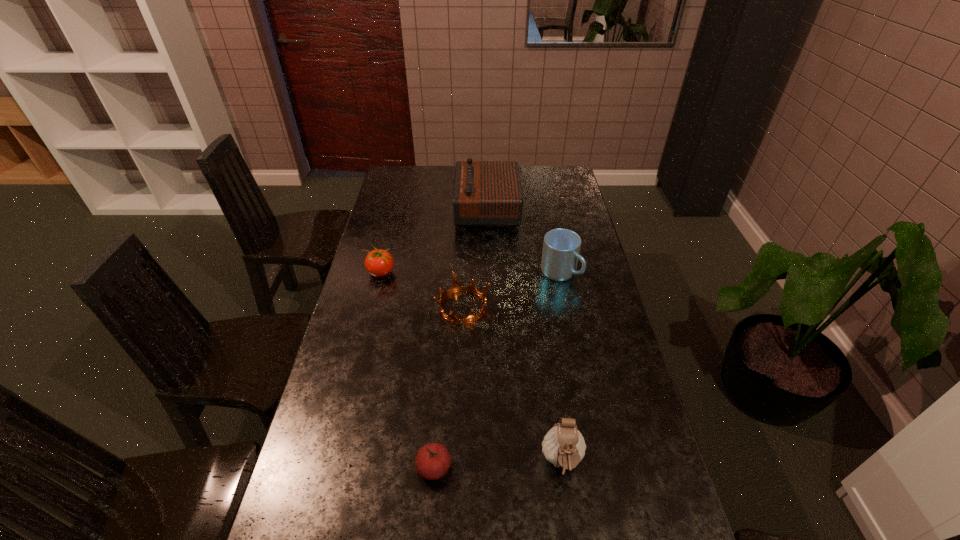
Locate an element on the screen. This screenshot has width=960, height=540. free spot located on the front panel of the tallest object is located at coordinates (433, 209).

Where is `vacant area situated 0.170m on the front panel of the tallest object`? vacant area situated 0.170m on the front panel of the tallest object is located at coordinates 417,209.

Where is `blank space located 0.290m on the back of the mug`? Image resolution: width=960 pixels, height=540 pixels. blank space located 0.290m on the back of the mug is located at coordinates (548, 216).

Where is `free space located on the front-facing side of the pouch`? The image size is (960, 540). free space located on the front-facing side of the pouch is located at coordinates (573, 539).

Where is `free space located 0.100m on the back of the left tomato`? free space located 0.100m on the back of the left tomato is located at coordinates (387, 247).

Locate an element on the screen. The width and height of the screenshot is (960, 540). free location located on the right of the nearer tomato is located at coordinates (509, 468).

Identify the location of blank space located on the front of the third nearest object. The image size is (960, 540). (460, 374).

You are a GUI agent. You are given a task and a screenshot of the screen. Output one action in this format:
    pyautogui.click(x=<x>, y=<y>)
    Task: Click on the object that is at the far edge
    This screenshot has width=960, height=540.
    Given the screenshot: What is the action you would take?
    pyautogui.click(x=486, y=193)

Where is `object present at the left edge`? This screenshot has width=960, height=540. object present at the left edge is located at coordinates (379, 263).

Locate an element on the screen. object at the right edge is located at coordinates coord(561,247).